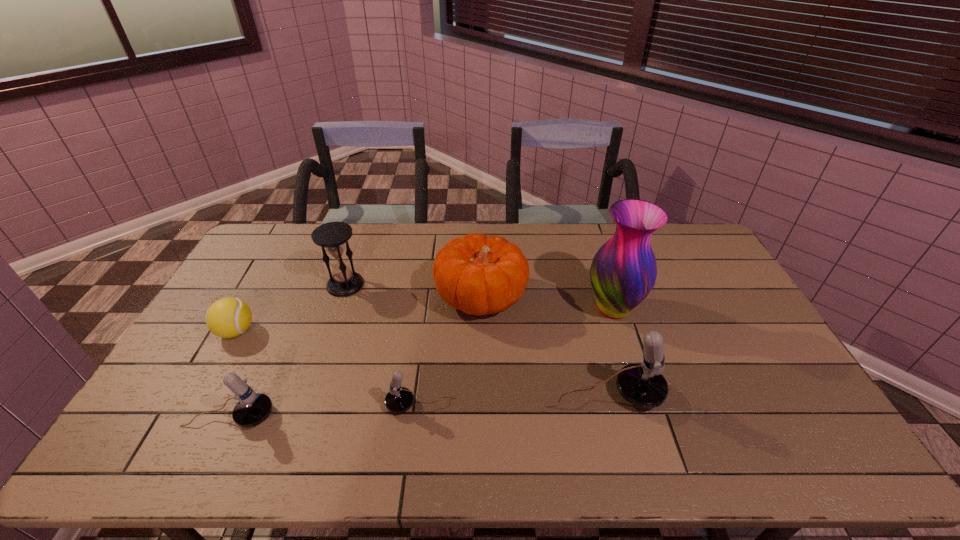
Locate an element on the screen. vacant region at the left edge is located at coordinates (273, 284).

In the image, there is a desktop. Identify the location of free space at the far left corner. 276,242.

At what (x,y) coordinates should I click in order to perform the action: click on free area in between the third shortest object and the vase. Please return your answer as a coordinate pair (x, y). Looking at the image, I should click on (421, 362).

The height and width of the screenshot is (540, 960). I want to click on unoccupied position between the second microphone from right to left and the pumpkin, so click(451, 352).

This screenshot has height=540, width=960. In order to click on blank region between the hourglass and the tennis ball in this screenshot , I will do `click(291, 308)`.

I want to click on free space between the tallest object and the tennis ball, so click(424, 320).

The image size is (960, 540). In order to click on blank region between the tennis ball and the tallest microphone in this screenshot , I will do `click(420, 363)`.

Locate an element on the screen. The height and width of the screenshot is (540, 960). empty location between the tennis ball and the vase is located at coordinates (424, 320).

This screenshot has height=540, width=960. In order to click on free space between the pumpkin and the shortest microphone in this screenshot , I will do 451,352.

The height and width of the screenshot is (540, 960). I want to click on free point between the shortest microphone and the pumpkin, so click(451, 352).